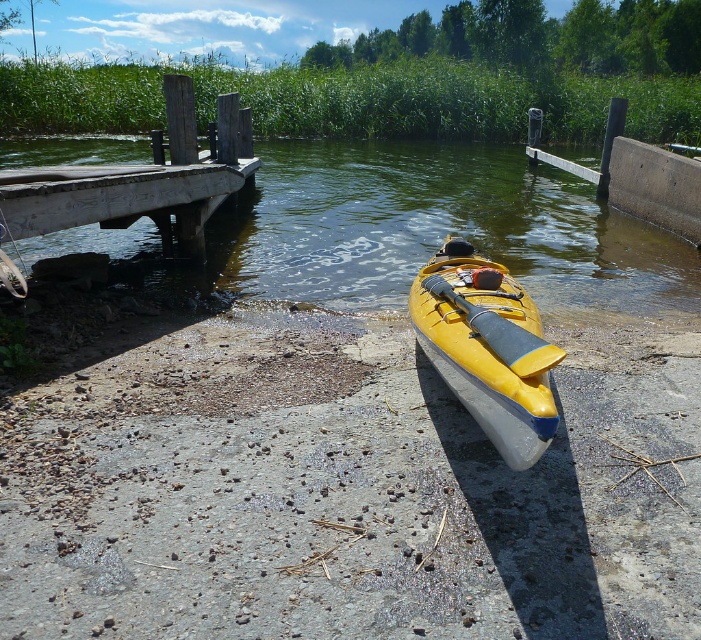
You are standing on the dock and see both the yellow plastic kayak at lower right and the yellow matte kayak at center. Which kayak is closer to the water edge?

The yellow plastic kayak at lower right is closer to the water edge because it is positioned to the left of the yellow matte kayak at center, and since the dock extends into the water, being further left means it is nearer to the edge.

You are standing on the dock and want to place a small buoy between the two points labeled point [215,241] and point [190,198]. Which point should the buoy be closer to in order to be closer to the camera?

The buoy should be closer to point [215,241] because it is further to the camera than point [190,198].